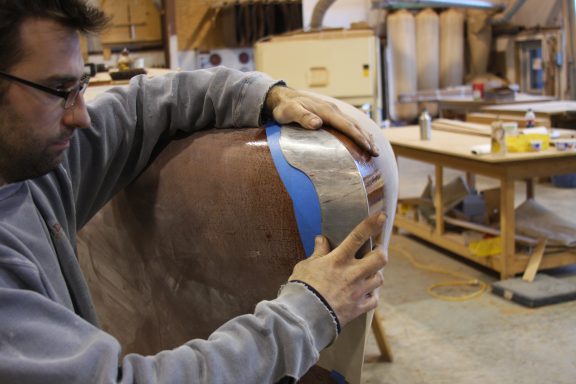
I want to click on wooden carving, so click(252, 213).